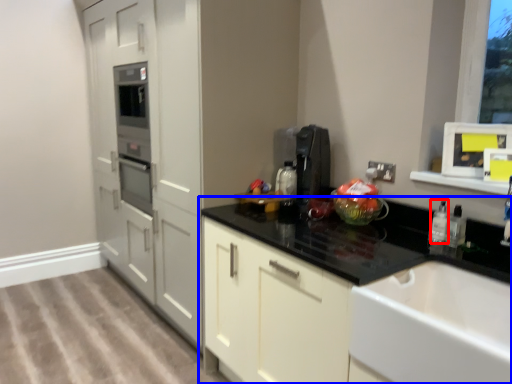
Question: Which of the following is the farthest to the observer, bottle (highlighted by a red box) or countertop (highlighted by a blue box)?

Choices:
 (A) bottle
 (B) countertop

Answer: (A)